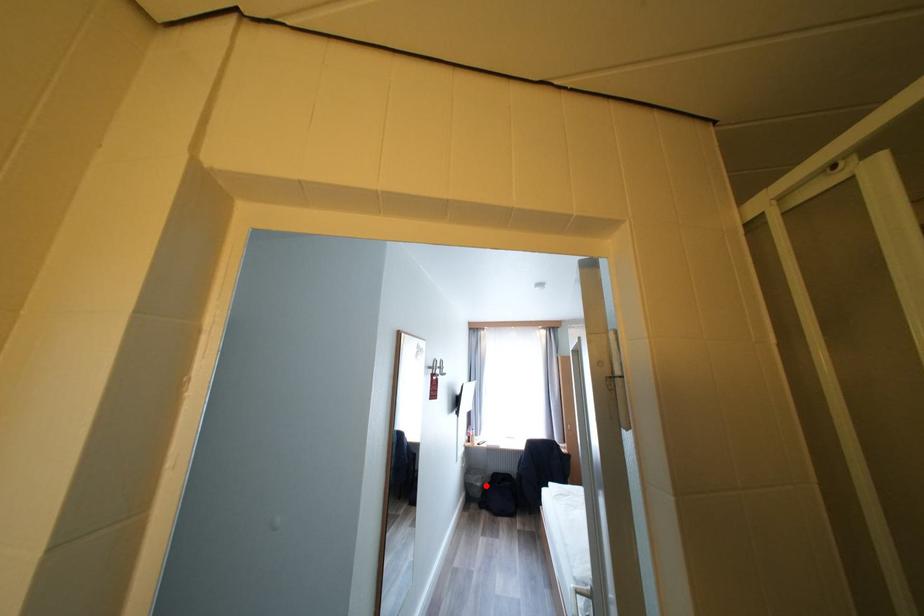
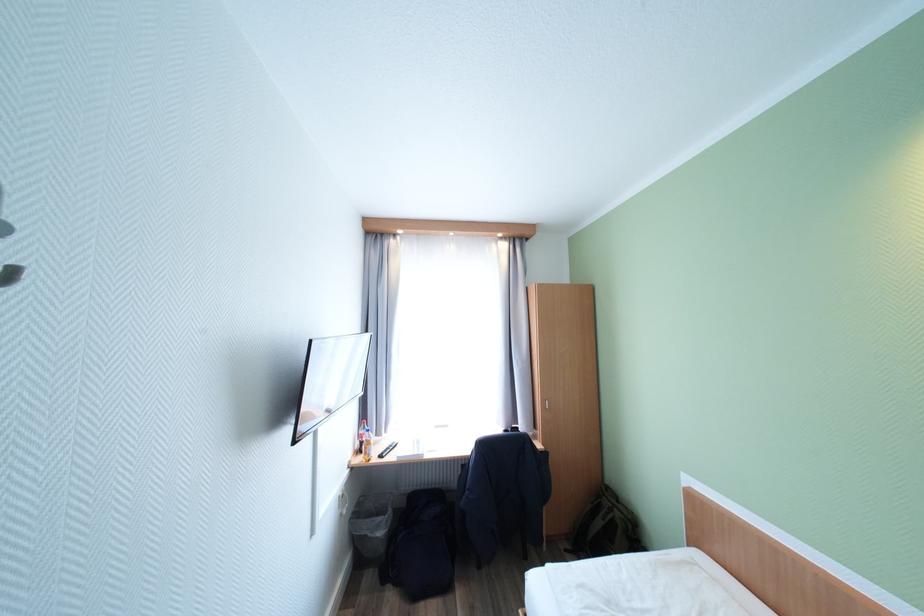
In the second image, find the point that corresponds to the highlighted location in the first image.

(387, 535)